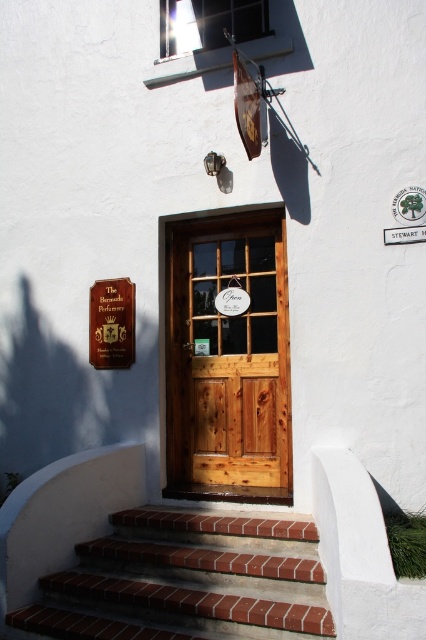
Is wooden door at center wider than gold metallic sign at upper center?

Correct, the width of wooden door at center exceeds that of gold metallic sign at upper center.

Between wooden door at center and gold metallic sign at upper center, which one has less height?

gold metallic sign at upper center

Image resolution: width=426 pixels, height=640 pixels. Describe the element at coordinates (227, 358) in the screenshot. I see `wooden door at center` at that location.

I want to click on wooden door at center, so click(227, 358).

Between brick/stamped concrete stairs at lower center and gold metallic sign at upper center, which one has more height?

With more height is gold metallic sign at upper center.

Does brick/stamped concrete stairs at lower center have a larger size compared to gold metallic sign at upper center?

Indeed, brick/stamped concrete stairs at lower center has a larger size compared to gold metallic sign at upper center.

Does point (164, 621) come behind point (132, 316)?

That is False.

Find the location of `brick/stamped concrete stairs at lower center`. brick/stamped concrete stairs at lower center is located at coordinates (187, 580).

Does wooden door at center have a lesser height compared to brick/stamped concrete stairs at lower center?

In fact, wooden door at center may be taller than brick/stamped concrete stairs at lower center.

Which of these two, wooden door at center or brick/stamped concrete stairs at lower center, stands shorter?

Standing shorter between the two is brick/stamped concrete stairs at lower center.

Is point (221, 323) positioned before point (123, 566)?

That is False.

The height and width of the screenshot is (640, 426). I want to click on wooden door at center, so click(x=227, y=358).